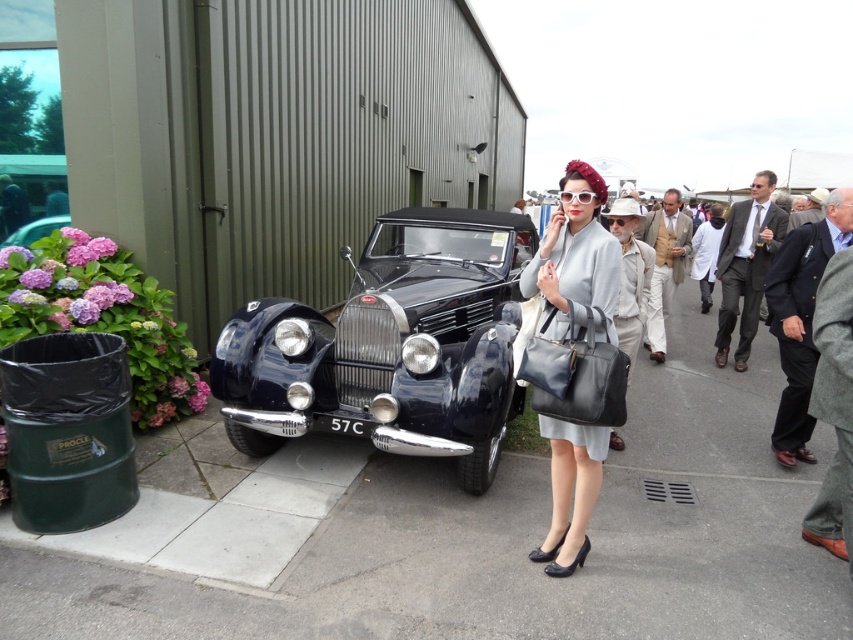
Question: Is light beige fabric briefcase at center positioned in front of light brown suit at center?

Choices:
 (A) no
 (B) yes

Answer: (B)

Question: Based on their relative distances, which object is nearer to the shiny dark blue car at center?

Choices:
 (A) gray wool suit at right
 (B) light beige fabric suit at center
 (C) light brown suit at center

Answer: (B)

Question: Where is dark blue suit at right located in relation to light beige fabric briefcase at center in the image?

Choices:
 (A) right
 (B) left

Answer: (A)

Question: Is gray wool suit at right in front of light beige fabric briefcase at center?

Choices:
 (A) no
 (B) yes

Answer: (A)

Question: Which point is farther from the camera taking this photo?

Choices:
 (A) (647, 314)
 (B) (788, 456)

Answer: (A)

Question: Which object appears farthest from the camera in this image?

Choices:
 (A) light brown suit at center
 (B) matte gray dress at center
 (C) shiny dark blue car at center
 (D) light beige fabric suit at center

Answer: (A)